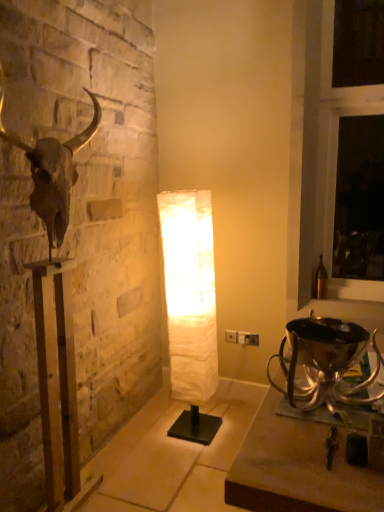
What are the coordinates of `free location in front of white paper lamp at center` in the screenshot? It's located at (188, 455).